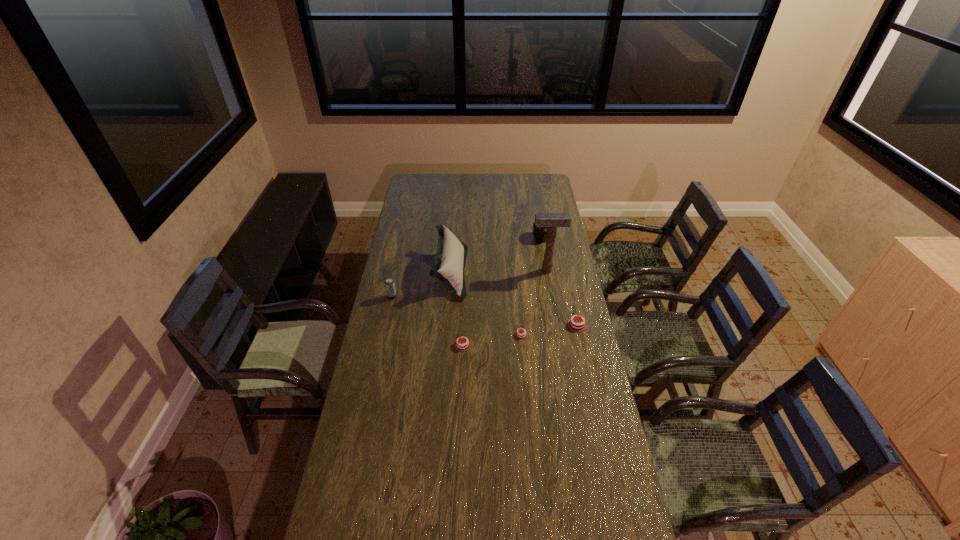
The height and width of the screenshot is (540, 960). Find the location of `blank region between the beer can and the rightmost chocolate cake`. blank region between the beer can and the rightmost chocolate cake is located at coordinates (485, 311).

What are the coordinates of `free space between the leftmost object and the tallest chocolate cake` in the screenshot? It's located at (485, 311).

Where is `vacant area between the rightmost chocolate cake and the leftmost object`? The image size is (960, 540). vacant area between the rightmost chocolate cake and the leftmost object is located at coordinates 485,311.

At what (x,y) coordinates should I click in order to perform the action: click on free spot between the telephoto lens and the mallet. Please return your answer as a coordinate pair (x, y). This screenshot has width=960, height=540. Looking at the image, I should click on (544, 254).

The height and width of the screenshot is (540, 960). Find the location of `blank region between the tallest object and the leftmost chocolate cake`. blank region between the tallest object and the leftmost chocolate cake is located at coordinates (504, 308).

Identify which object is the nearest to the farthest object. Please provide its 2D coordinates. Your answer should be formatted as a tuple, i.e. [(x, y)], where the tuple contains the x and y coordinates of a point satisfying the conditions above.

[(551, 220)]

At what (x,y) coordinates should I click in order to perform the action: click on the closest object to the tallest object. Please return your answer as a coordinate pair (x, y). The height and width of the screenshot is (540, 960). Looking at the image, I should click on (540, 233).

Where is `chocolate cake that is the closest to the cushion`? chocolate cake that is the closest to the cushion is located at coordinates (462, 345).

The image size is (960, 540). Find the location of `the closest chocolate cake to the tallest chocolate cake`. the closest chocolate cake to the tallest chocolate cake is located at coordinates (519, 334).

Where is `vacant space that satisfies the following two spatial constraints: 1. on the back side of the second chocolate cake from right to left; 2. on the right side of the tallest object`? vacant space that satisfies the following two spatial constraints: 1. on the back side of the second chocolate cake from right to left; 2. on the right side of the tallest object is located at coordinates (516, 271).